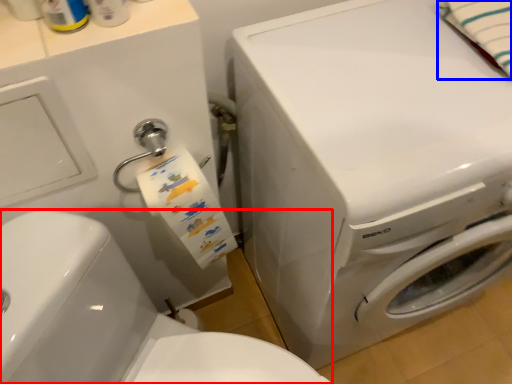
Question: Among these objects, which one is nearest to the camera, washer (highlighted by a red box) or bath towel (highlighted by a blue box)?

Choices:
 (A) washer
 (B) bath towel

Answer: (A)